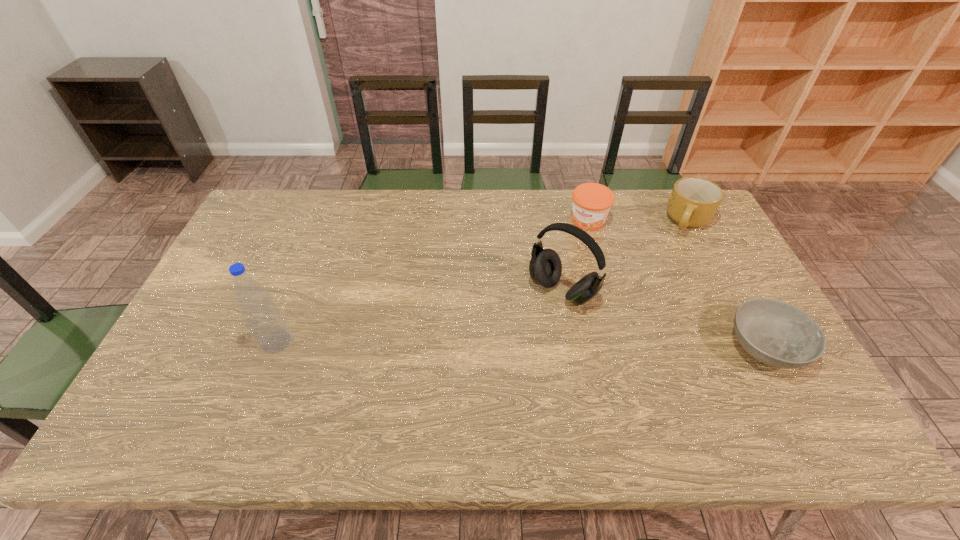
You are a GUI agent. You are given a task and a screenshot of the screen. Output one action in this format:
    pyautogui.click(x=<x>, y=<y>)
    Task: Click on the free space on the desktop that is between the tallest object and the shortest object and is positioned on the ear cups of the fourth shortest object
    The height and width of the screenshot is (540, 960).
    Given the screenshot: What is the action you would take?
    pyautogui.click(x=512, y=344)

Image resolution: width=960 pixels, height=540 pixels. Find the location of `vacant space on the desktop that is between the tallest object and the shortest object and is positioned on the front label of the jam`. vacant space on the desktop that is between the tallest object and the shortest object and is positioned on the front label of the jam is located at coordinates (494, 344).

Where is `free space on the desktop that is between the water bottle and the bowl and is positioned on the side with the handle of the mug`? free space on the desktop that is between the water bottle and the bowl and is positioned on the side with the handle of the mug is located at coordinates (570, 345).